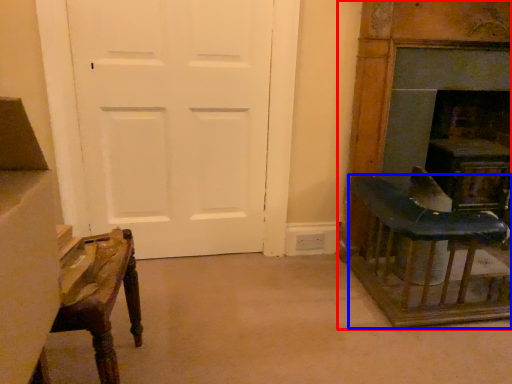
Question: Which of the following is the closest to the observer, furniture (highlighted by a red box) or table (highlighted by a blue box)?

Choices:
 (A) furniture
 (B) table

Answer: (B)